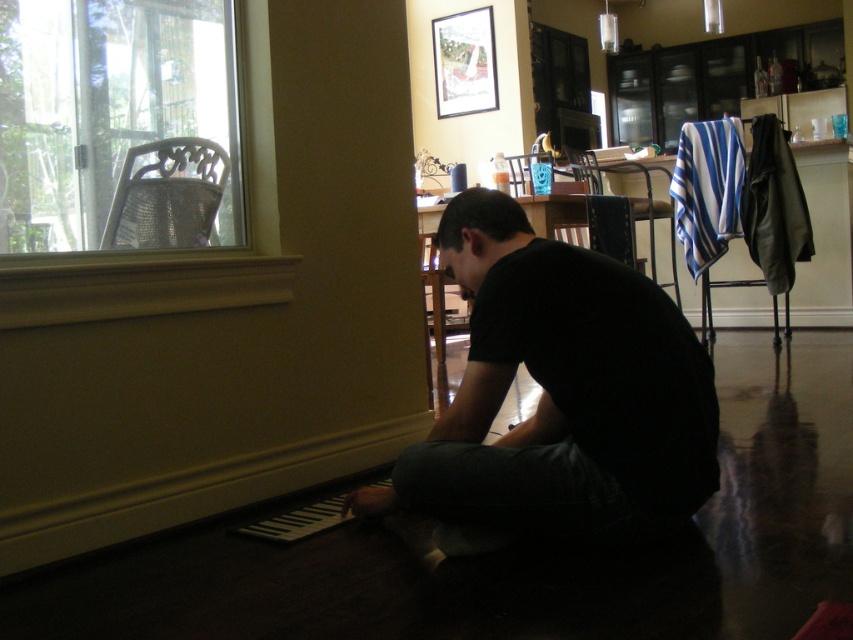
Who is more distant from viewer, (647, 280) or (62, 77)?

Positioned behind is point (62, 77).

This screenshot has width=853, height=640. In order to click on black matte shirt at lower center in this screenshot , I will do `click(560, 394)`.

Is point (677, 376) more distant than point (227, 32)?

That is False.

This screenshot has width=853, height=640. I want to click on black matte shirt at lower center, so click(560, 394).